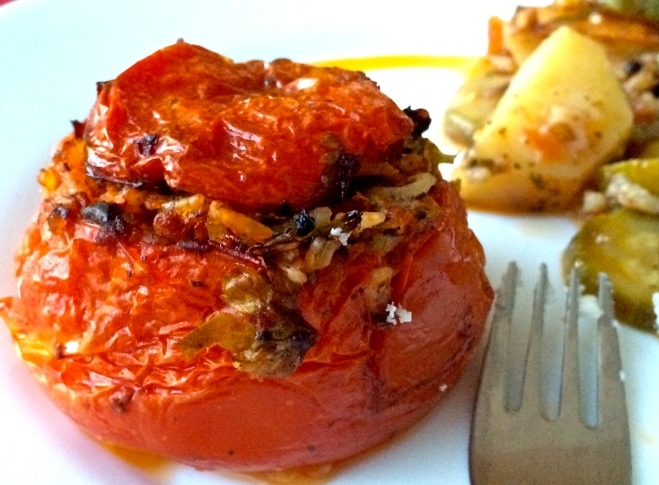
Where is `gray shadow under the food next to the fork`? gray shadow under the food next to the fork is located at coordinates (442, 443).